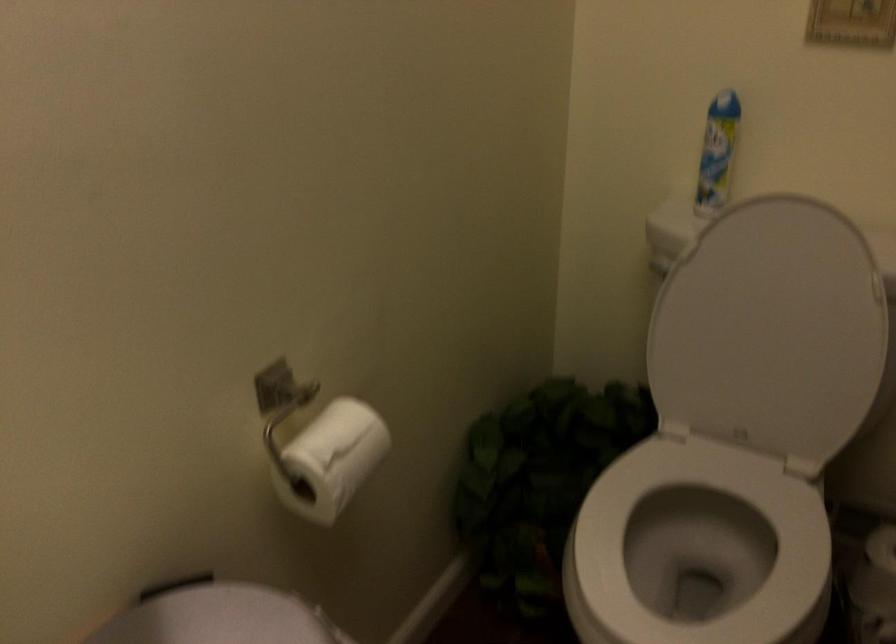
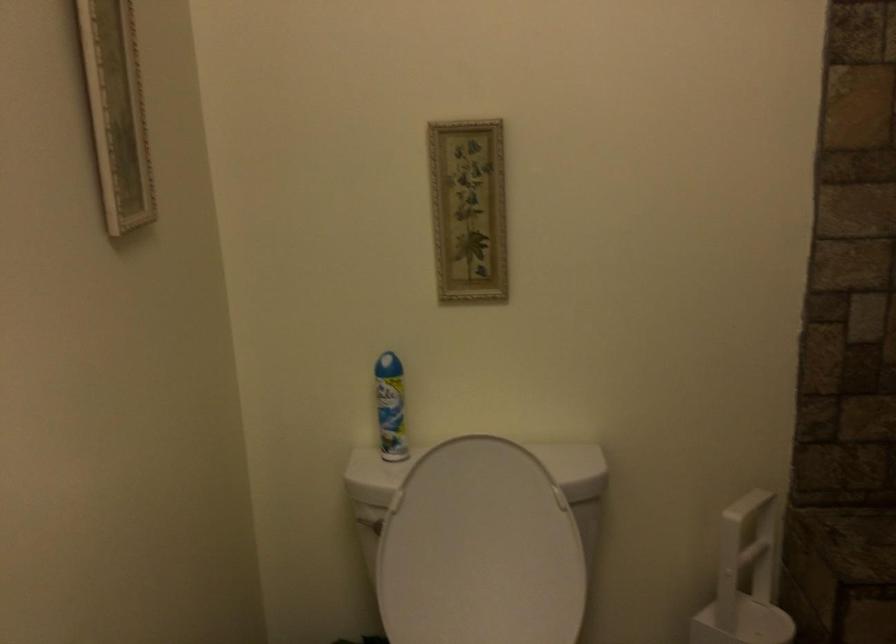
Where in the second image is the point corresponding to pixel 764 324 from the first image?

(479, 550)